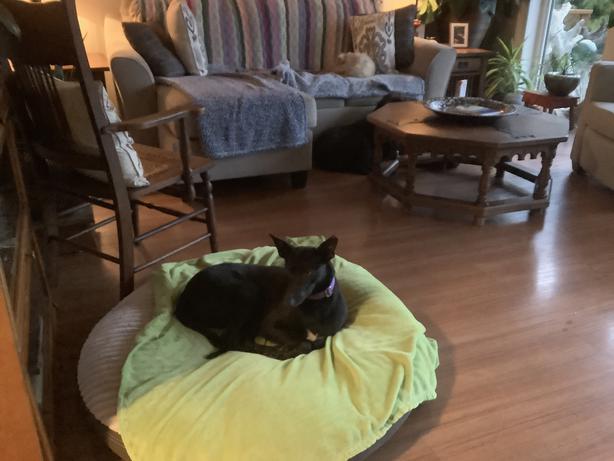
At what (x,y) coordinates should I click in order to perform the action: click on floor. Please return your answer as a coordinate pair (x, y). This screenshot has height=461, width=614. Looking at the image, I should click on (483, 290).